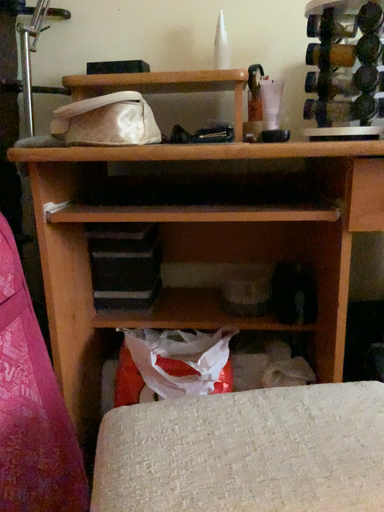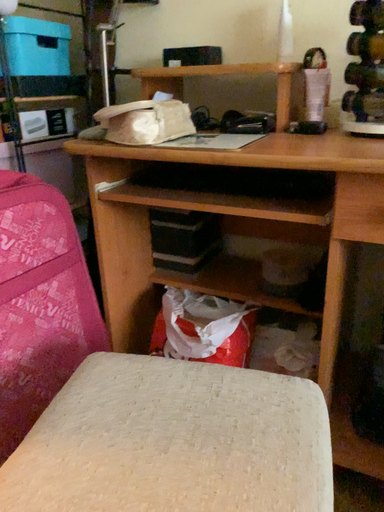
Question: Which way did the camera rotate in the video?

Choices:
 (A) rotated downward
 (B) rotated upward

Answer: (A)